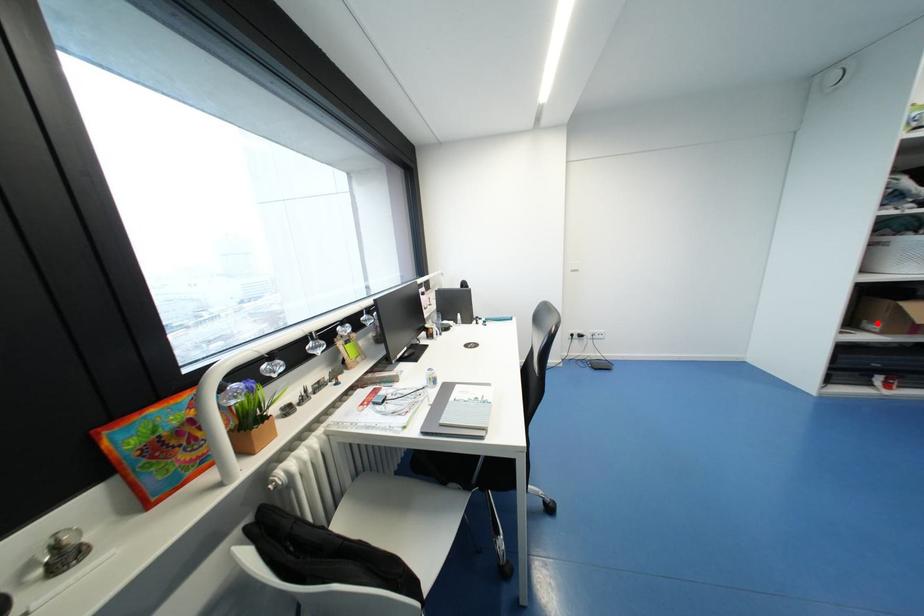
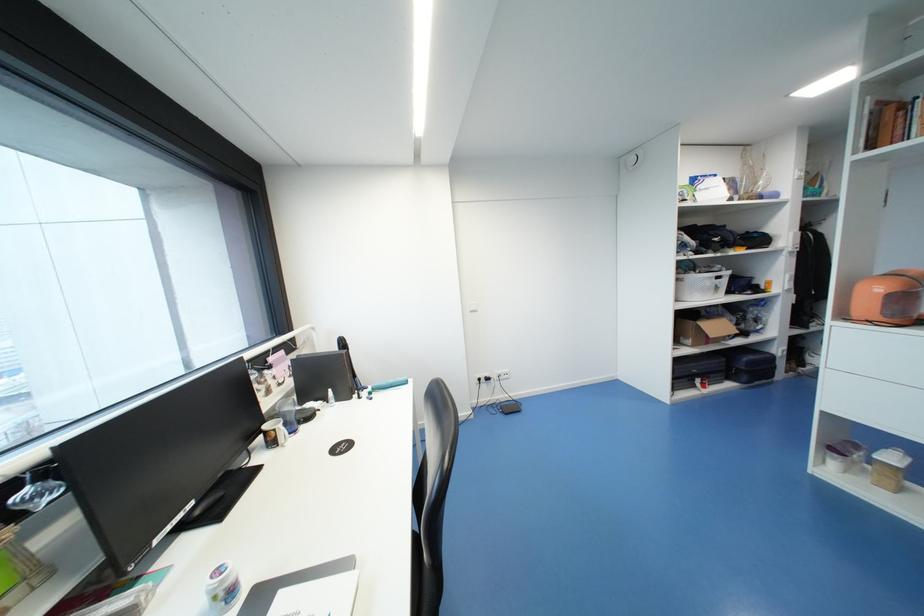
Question: I am providing you with two images of the same scene from different viewpoints. A red point is marked on the first image. At the location where the point appears in image 1, is it still visible in image 2?

Choices:
 (A) Yes
 (B) No

Answer: (A)